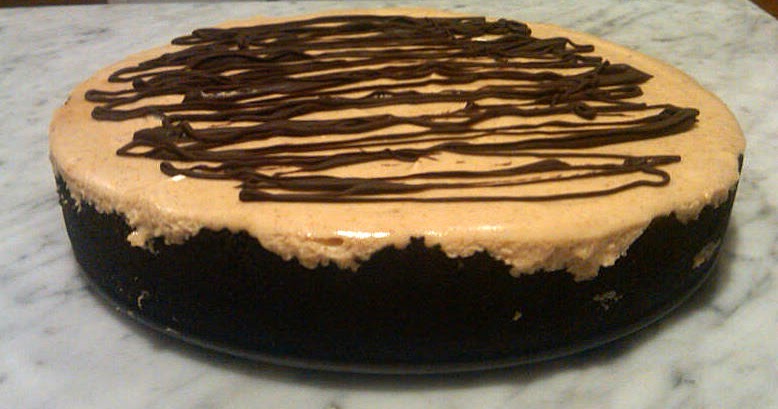
The width and height of the screenshot is (778, 409). What are the coordinates of `white marble counter top` in the screenshot? It's located at (76, 359).